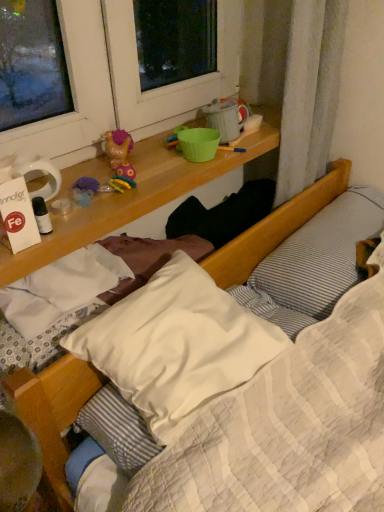
What do you see at coordinates (116, 147) in the screenshot?
I see `gold plastic toy at upper center` at bounding box center [116, 147].

The width and height of the screenshot is (384, 512). In order to click on white striped pillow at upper right, the 2th pillow when ordered from left to right in this screenshot , I will do `click(321, 254)`.

Where is `gold plastic toy at upper center`? The height and width of the screenshot is (512, 384). gold plastic toy at upper center is located at coordinates (116, 147).

Could you tell me if white striped pillow at upper right, the 2th pillow when ordered from left to right, is turned towards white soft pillow at center, the 2th pillow positioned from the right?

No, white striped pillow at upper right, the 2th pillow when ordered from left to right, is not facing towards white soft pillow at center, the 2th pillow positioned from the right.

Considering the sizes of objects white striped pillow at upper right, acting as the first pillow starting from the right, and white soft pillow at center, the 2th pillow positioned from the right, in the image provided, who is shorter, white striped pillow at upper right, acting as the first pillow starting from the right, or white soft pillow at center, the 2th pillow positioned from the right,?

white soft pillow at center, the 2th pillow positioned from the right.

From a real-world perspective, which object stands above the other?

white striped pillow at upper right, acting as the first pillow starting from the right, from a real-world perspective.

Looking at the image, does white striped pillow at upper right, acting as the first pillow starting from the right, seem bigger or smaller compared to white soft pillow at center, the first pillow from the left?

Considering their sizes, white striped pillow at upper right, acting as the first pillow starting from the right, takes up more space than white soft pillow at center, the first pillow from the left.

In the image, is white soft pillow at center, the 2th pillow positioned from the right, positioned in front of or behind white striped pillow at upper right, acting as the first pillow starting from the right?

Visually, white soft pillow at center, the 2th pillow positioned from the right, is located in front of white striped pillow at upper right, acting as the first pillow starting from the right.

Is white soft pillow at center, the 2th pillow positioned from the right, aimed at white striped pillow at upper right, acting as the first pillow starting from the right?

No.

Which of these two, white soft pillow at center, the first pillow from the left, or white striped pillow at upper right, acting as the first pillow starting from the right, is smaller?

white soft pillow at center, the first pillow from the left, is smaller.

Would you consider white soft pillow at center, the 2th pillow positioned from the right, to be distant from white striped pillow at upper right, acting as the first pillow starting from the right?

white soft pillow at center, the 2th pillow positioned from the right, is near white striped pillow at upper right, acting as the first pillow starting from the right, not far away.

Is gold plastic toy at upper center in front of or behind white striped pillow at upper right, acting as the first pillow starting from the right, in the image?

Clearly, gold plastic toy at upper center is in front of white striped pillow at upper right, acting as the first pillow starting from the right.

From a real-world perspective, between gold plastic toy at upper center and white striped pillow at upper right, acting as the first pillow starting from the right, who is vertically lower?

In real-world perspective, white striped pillow at upper right, acting as the first pillow starting from the right, is lower.

Is gold plastic toy at upper center beside white striped pillow at upper right, the 2th pillow when ordered from left to right?

No, gold plastic toy at upper center is not touching white striped pillow at upper right, the 2th pillow when ordered from left to right.

Does gold plastic toy at upper center have a greater height compared to white striped pillow at upper right, acting as the first pillow starting from the right?

Incorrect, the height of gold plastic toy at upper center is not larger of that of white striped pillow at upper right, acting as the first pillow starting from the right.

Does point (119, 130) come closer to viewer compared to point (93, 347)?

No, (119, 130) is further to viewer.

Does gold plastic toy at upper center lie in front of white soft pillow at center, the first pillow from the left?

No.

What's the angular difference between gold plastic toy at upper center and white soft pillow at center, the first pillow from the left,'s facing directions?

gold plastic toy at upper center and white soft pillow at center, the first pillow from the left, are facing 4.33 degrees away from each other.

How much distance is there between gold plastic toy at upper center and white soft pillow at center, the first pillow from the left?

gold plastic toy at upper center and white soft pillow at center, the first pillow from the left, are 41.71 centimeters apart from each other.

Looking at their sizes, would you say white soft pillow at center, the 2th pillow positioned from the right, is wider or thinner than gold plastic toy at upper center?

In the image, white soft pillow at center, the 2th pillow positioned from the right, appears to be wider than gold plastic toy at upper center.

Between white soft pillow at center, the 2th pillow positioned from the right, and gold plastic toy at upper center, which one is positioned behind?

Positioned behind is gold plastic toy at upper center.

Considering the relative sizes of white soft pillow at center, the first pillow from the left, and gold plastic toy at upper center in the image provided, is white soft pillow at center, the first pillow from the left, smaller than gold plastic toy at upper center?

Actually, white soft pillow at center, the first pillow from the left, might be larger than gold plastic toy at upper center.

From a real-world perspective, is white striped pillow at upper right, the 2th pillow when ordered from left to right, over gold plastic toy at upper center?

Actually, white striped pillow at upper right, the 2th pillow when ordered from left to right, is physically below gold plastic toy at upper center in the real world.

Does white striped pillow at upper right, the 2th pillow when ordered from left to right, have a greater width compared to gold plastic toy at upper center?

Correct, the width of white striped pillow at upper right, the 2th pillow when ordered from left to right, exceeds that of gold plastic toy at upper center.

Which object is more forward, white striped pillow at upper right, acting as the first pillow starting from the right, or gold plastic toy at upper center?

Positioned in front is gold plastic toy at upper center.

Which is correct: white striped pillow at upper right, acting as the first pillow starting from the right, is inside gold plastic toy at upper center, or outside of it?

white striped pillow at upper right, acting as the first pillow starting from the right, cannot be found inside gold plastic toy at upper center.

What are the coordinates of `pillow in front of the white striped pillow at upper right, acting as the first pillow starting from the right` in the screenshot? It's located at (176, 345).

The width and height of the screenshot is (384, 512). I want to click on pillow that is below the white striped pillow at upper right, acting as the first pillow starting from the right (from the image's perspective), so click(x=176, y=345).

Considering their positions, is white striped pillow at upper right, the 2th pillow when ordered from left to right, positioned closer to gold plastic toy at upper center than white soft pillow at center, the first pillow from the left?

white soft pillow at center, the first pillow from the left.

Estimate the real-world distances between objects in this image. Which object is further from white soft pillow at center, the first pillow from the left, gold plastic toy at upper center or white striped pillow at upper right, acting as the first pillow starting from the right?

Based on the image, white striped pillow at upper right, acting as the first pillow starting from the right, appears to be further to white soft pillow at center, the first pillow from the left.

Considering their positions, is gold plastic toy at upper center positioned closer to white striped pillow at upper right, the 2th pillow when ordered from left to right, than white soft pillow at center, the first pillow from the left?

white soft pillow at center, the first pillow from the left, is closer to white striped pillow at upper right, the 2th pillow when ordered from left to right.

Estimate the real-world distances between objects in this image. Which object is further from gold plastic toy at upper center, white soft pillow at center, the first pillow from the left, or white striped pillow at upper right, the 2th pillow when ordered from left to right?

white striped pillow at upper right, the 2th pillow when ordered from left to right.

From the image, which object appears to be nearer to white soft pillow at center, the first pillow from the left, white striped pillow at upper right, the 2th pillow when ordered from left to right, or gold plastic toy at upper center?

gold plastic toy at upper center.

Considering their positions, is white soft pillow at center, the 2th pillow positioned from the right, positioned further to white striped pillow at upper right, the 2th pillow when ordered from left to right, than gold plastic toy at upper center?

gold plastic toy at upper center is further to white striped pillow at upper right, the 2th pillow when ordered from left to right.

At what (x,y) coordinates should I click in order to perform the action: click on pillow between gold plastic toy at upper center and white striped pillow at upper right, acting as the first pillow starting from the right, from left to right. Please return your answer as a coordinate pair (x, y). Image resolution: width=384 pixels, height=512 pixels. Looking at the image, I should click on (176, 345).